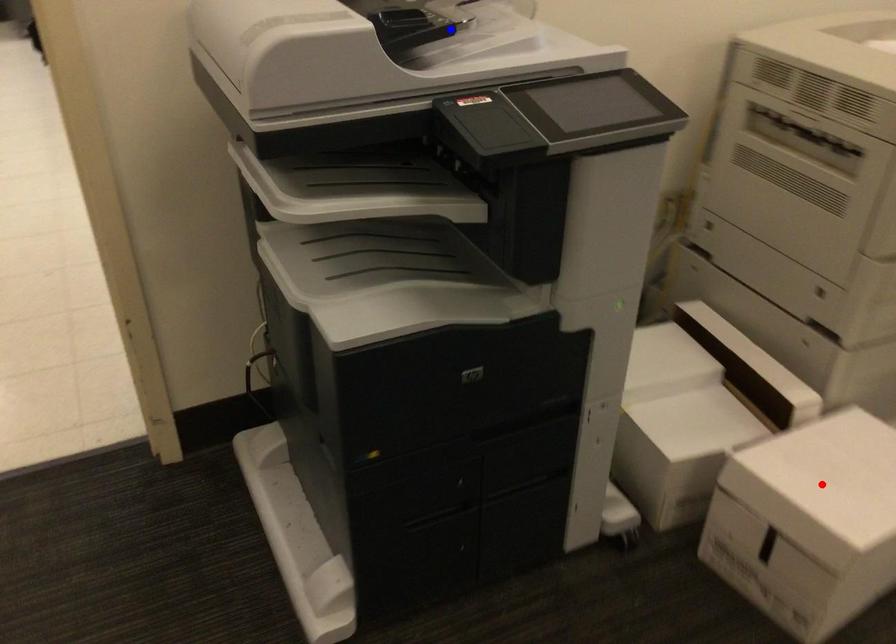
Question: Which of the two points in the image is closer to the camera?

Choices:
 (A) Blue point is closer.
 (B) Red point is closer.

Answer: (A)